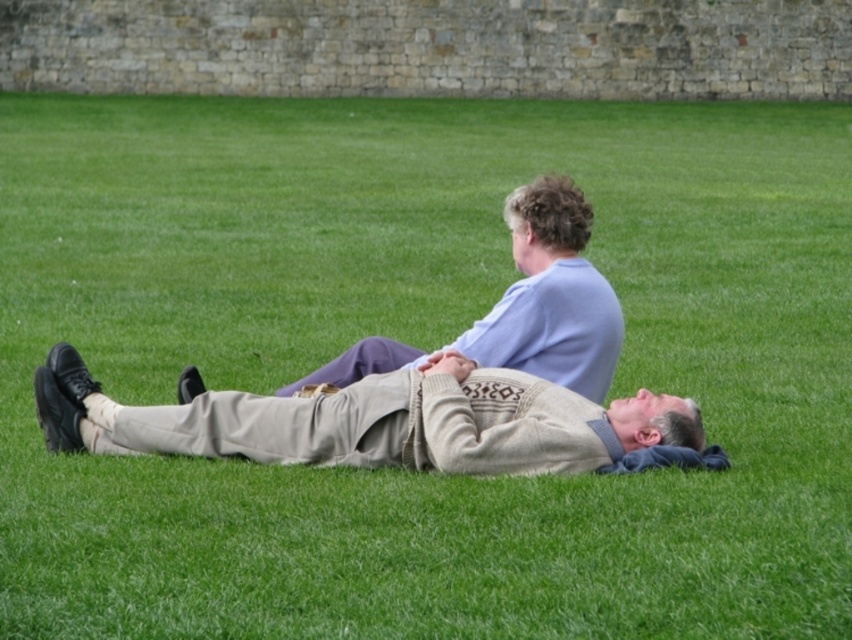
Between knit sweater at center and light blue fabric shirt at upper center, which one has more height?

Standing taller between the two is knit sweater at center.

Does point (275, 456) come farther from viewer compared to point (401, 349)?

No, (275, 456) is in front of (401, 349).

You are a GUI agent. You are given a task and a screenshot of the screen. Output one action in this format:
    pyautogui.click(x=<x>, y=<y>)
    Task: Click on the knit sweater at center
    This screenshot has width=852, height=640.
    Given the screenshot: What is the action you would take?
    pyautogui.click(x=373, y=420)